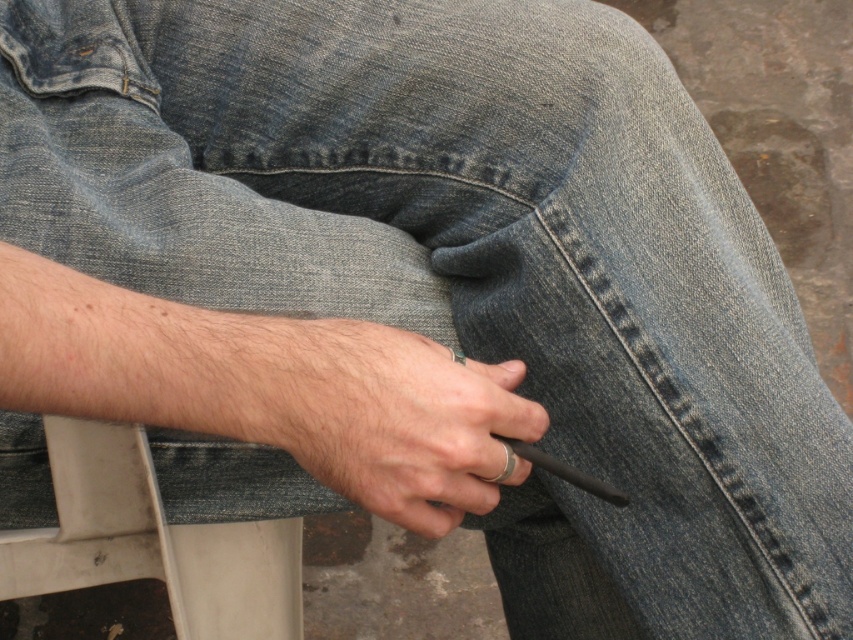
You are organizing a desk and need to place the matte black pen at center and the white plastic chair at lower left. Given their sizes, which object should you place first to ensure both fit on the desk?

The matte black pen at center occupies less space than the white plastic chair at lower left, so you should place the white plastic chair at lower left first to accommodate its larger size before placing the smaller pen.

You are a detective examining the scene. You see a matte black pen at center and a black matte cigarette at center. Which object is positioned higher?

The matte black pen at center is above the black matte cigarette at center.